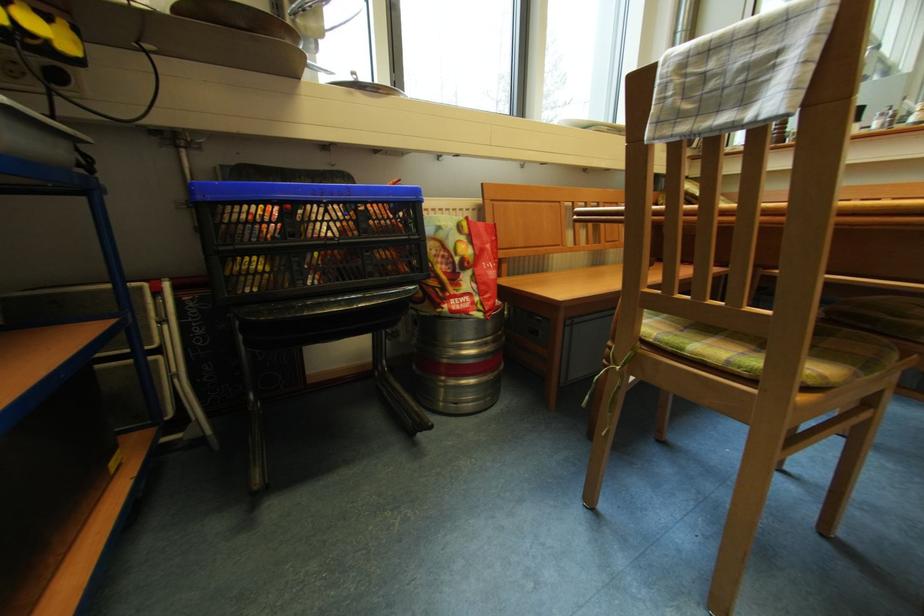
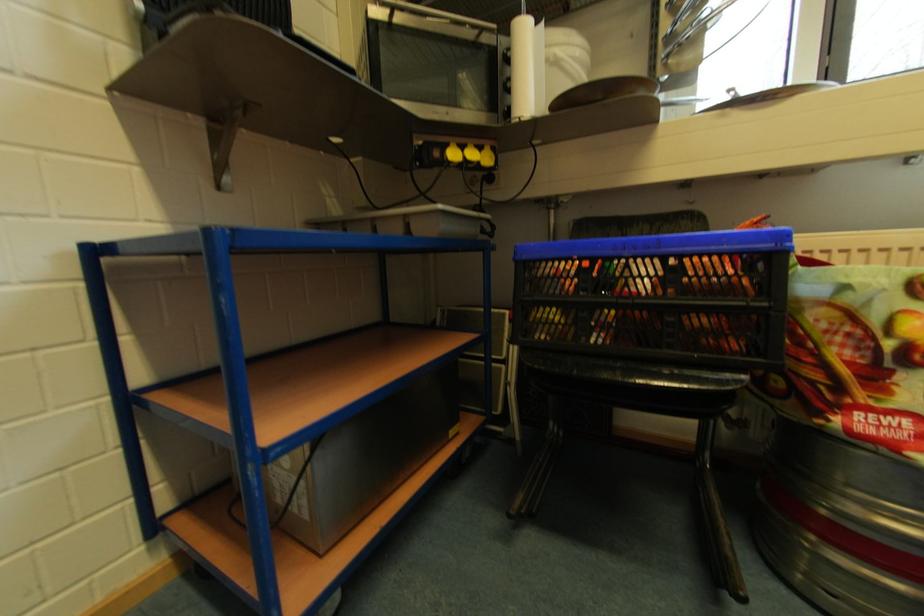
Question: The camera is either moving clockwise (left) or counter-clockwise (right) around the object. The first image is from the beginning of the video and the second image is from the end. Is the camera moving left or right when shooting the video?

Choices:
 (A) Left
 (B) Right

Answer: (B)